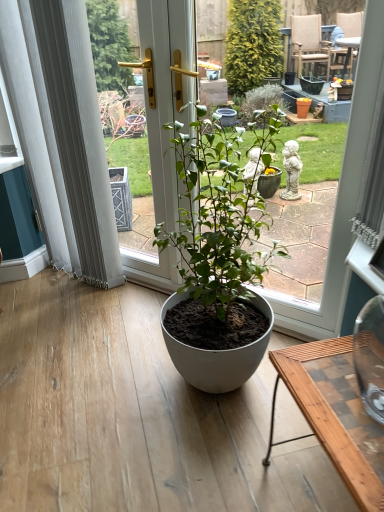
The height and width of the screenshot is (512, 384). Find the location of `vacant space that is to the left of matte white pot at center`. vacant space that is to the left of matte white pot at center is located at coordinates (127, 332).